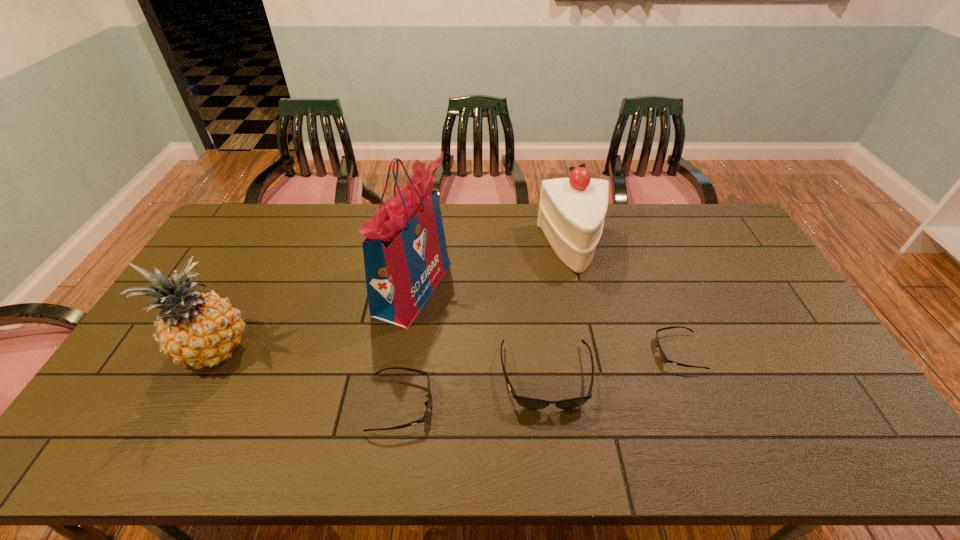
In the image, there is a desktop. Identify the location of free region at the near edge. (413, 405).

In the image, there is a desktop. At what (x,y) coordinates should I click in order to perform the action: click on vacant space at the left edge. Please return your answer as a coordinate pair (x, y). This screenshot has height=540, width=960. Looking at the image, I should click on (230, 293).

Identify the location of vacant area at the right edge. This screenshot has width=960, height=540. (774, 354).

This screenshot has width=960, height=540. What are the coordinates of `vacant space at the far left corner of the desktop` in the screenshot? It's located at (227, 227).

Identify the location of free spot between the tallest object and the fifth shortest object. The height and width of the screenshot is (540, 960). (314, 320).

Locate an element on the screen. The image size is (960, 540). free point between the fifth tallest object and the pineapple is located at coordinates (307, 378).

I want to click on vacant point located between the leftmost sunglasses and the tallest object, so click(x=407, y=346).

The height and width of the screenshot is (540, 960). In order to click on free space between the tallest sunglasses and the tallest object in this screenshot , I will do `click(480, 333)`.

Locate an element on the screen. blank region between the grocery bag and the fourth shortest object is located at coordinates (493, 268).

Identify the location of free space that is in between the tallest object and the pineapple. This screenshot has width=960, height=540. (314, 320).